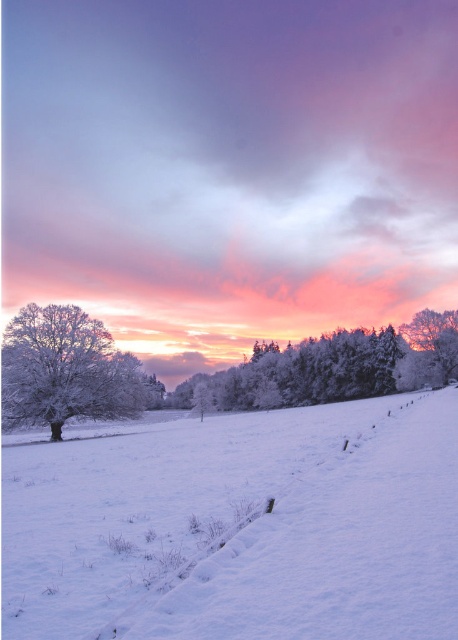
Which is behind, point (223, 577) or point (98, 340)?

Positioned behind is point (98, 340).

Can you confirm if white frosty snow at center is shorter than white frosty tree at left?

Indeed, white frosty snow at center has a lesser height compared to white frosty tree at left.

You are a GUI agent. You are given a task and a screenshot of the screen. Output one action in this format:
    pyautogui.click(x=<x>, y=<y>)
    Task: Click on the white frosty snow at center
    Image resolution: width=458 pixels, height=640 pixels.
    Given the screenshot: What is the action you would take?
    pyautogui.click(x=239, y=528)

The height and width of the screenshot is (640, 458). Find the location of `white frosty snow at center`. white frosty snow at center is located at coordinates (239, 528).

Who is higher up, frosted glass trees at center or white frosty tree at left?

white frosty tree at left

This screenshot has width=458, height=640. Describe the element at coordinates (336, 365) in the screenshot. I see `frosted glass trees at center` at that location.

You are a GUI agent. You are given a task and a screenshot of the screen. Output one action in this format:
    pyautogui.click(x=<x>, y=<y>)
    Task: Click on the frosted glass trees at center
    
    Given the screenshot: What is the action you would take?
    pyautogui.click(x=336, y=365)

Which of these two, white frosty snow at center or frosted glass trees at center, stands taller?

With more height is frosted glass trees at center.

Is point (343, 428) in front of point (394, 332)?

Yes, it is.

Locate an element on the screen. This screenshot has width=458, height=640. white frosty snow at center is located at coordinates (239, 528).